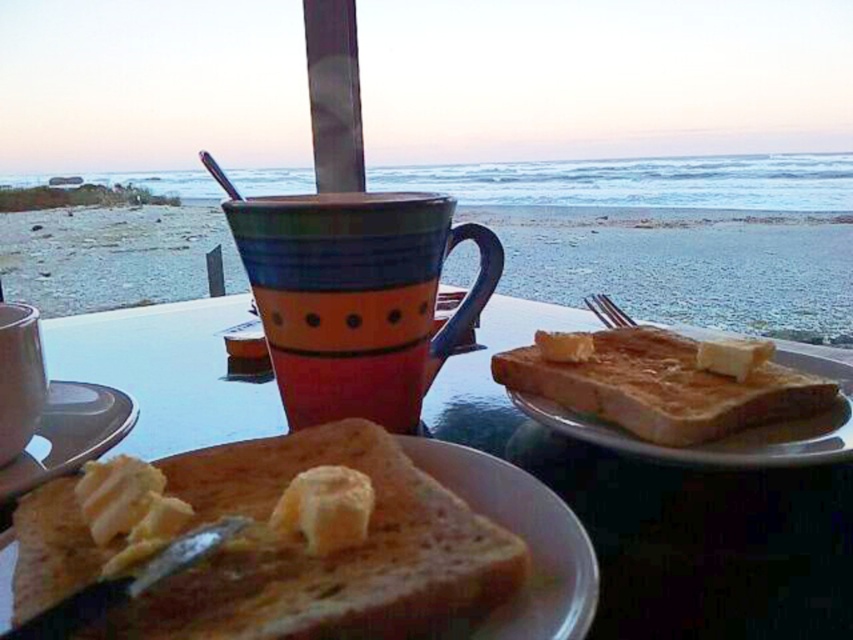
Where is `golden brown toasted bread at lower left`? golden brown toasted bread at lower left is located at coordinates (328, 556).

Which is below, golden brown toasted bread at lower left or matte ceramic mug at center?

golden brown toasted bread at lower left is below.

Is point (497, 525) more distant than point (160, 262)?

No.

Identify the location of golden brown toasted bread at lower left. This screenshot has height=640, width=853. (328, 556).

Between matte ceramic plate at center and matte ceramic mug at lower left, which one appears on the left side from the viewer's perspective?

matte ceramic mug at lower left

Is matte ceramic plate at center shorter than matte ceramic mug at lower left?

In fact, matte ceramic plate at center may be taller than matte ceramic mug at lower left.

Does point (639, 625) lie behind point (19, 326)?

No, it is in front of (19, 326).

The image size is (853, 640). I want to click on matte ceramic plate at center, so click(x=711, y=557).

Is matte plastic butter at lower left to the left of matte ceramic mug at lower left from the viewer's perspective?

No, matte plastic butter at lower left is not to the left of matte ceramic mug at lower left.

Is point (44, 403) less distant than point (15, 316)?

Yes.

The height and width of the screenshot is (640, 853). Find the location of `matte plastic butter at lower left`. matte plastic butter at lower left is located at coordinates (68, 433).